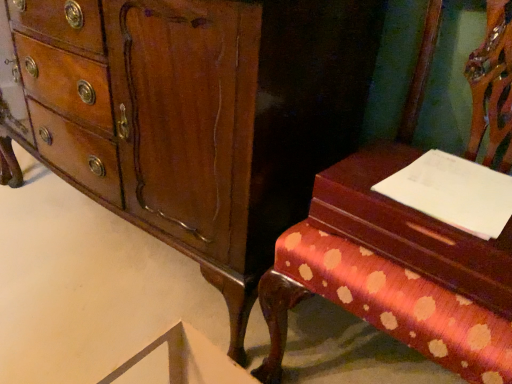
In order to click on free space above white paper at right (from a real-world perspective) in this screenshot , I will do `click(449, 195)`.